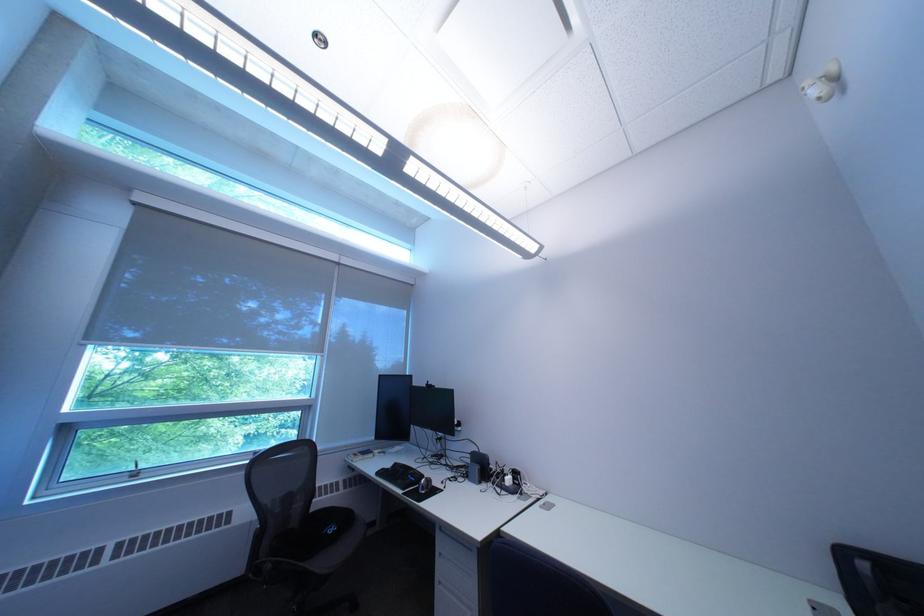
Find the location of `chair sitting surface`. chair sitting surface is located at coordinates (295, 543).